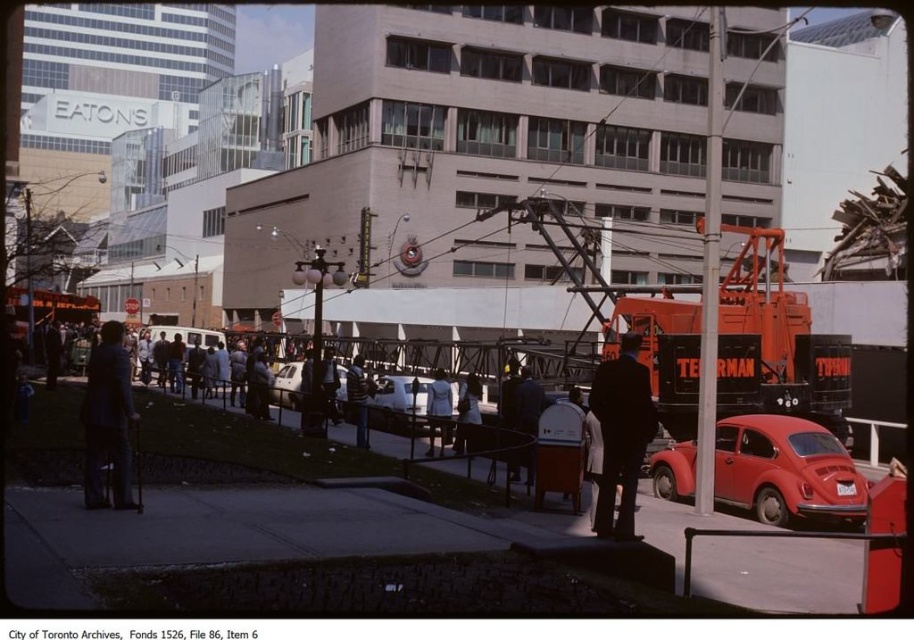
Consider the image. Does matte red volkswagen beetle at lower right appear on the left side of shiny silver car at center?

No, matte red volkswagen beetle at lower right is not to the left of shiny silver car at center.

Does point (782, 520) come farther from viewer compared to point (274, 401)?

No, it is in front of (274, 401).

Identify the location of matte red volkswagen beetle at lower right. The image size is (914, 640). (785, 468).

Is dark blue suit at center bigger than light blue denim jacket at center?

Correct, dark blue suit at center is larger in size than light blue denim jacket at center.

Does dark blue suit at center appear over light blue denim jacket at center?

Correct, dark blue suit at center is located above light blue denim jacket at center.

The image size is (914, 640). What do you see at coordinates (107, 419) in the screenshot?
I see `dark blue suit at center` at bounding box center [107, 419].

Where is `dark blue suit at center`? This screenshot has height=640, width=914. dark blue suit at center is located at coordinates (107, 419).

Who is more forward, (125, 490) or (293, 368)?

Point (125, 490) is in front.

What do you see at coordinates (107, 419) in the screenshot?
I see `dark blue suit at center` at bounding box center [107, 419].

Where is `dark blue suit at center`? dark blue suit at center is located at coordinates (107, 419).